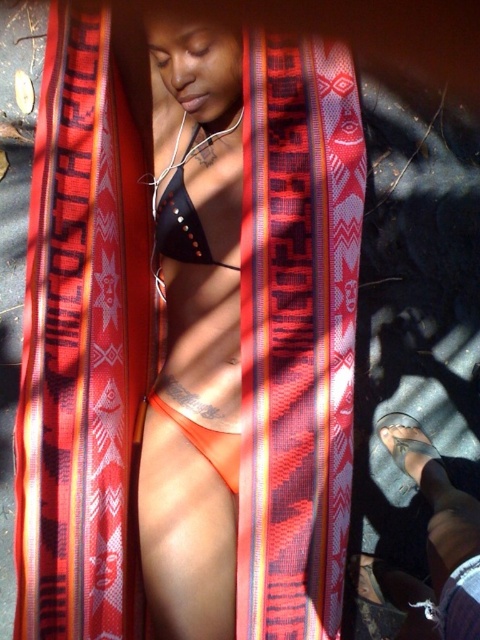
Is orange fabric bikini bottom at center positioned before orange matte bikini at center?

Yes, orange fabric bikini bottom at center is in front of orange matte bikini at center.

The image size is (480, 640). What do you see at coordinates (199, 337) in the screenshot? I see `orange fabric bikini bottom at center` at bounding box center [199, 337].

Image resolution: width=480 pixels, height=640 pixels. I want to click on orange fabric bikini bottom at center, so click(199, 337).

In the scene shown: Who is more forward, (202, 145) or (184, 202)?

Point (184, 202)

Does orange fabric bikini bottom at center have a lesser height compared to black studded bikini top at center?

No.

The width and height of the screenshot is (480, 640). Describe the element at coordinates (199, 337) in the screenshot. I see `orange fabric bikini bottom at center` at that location.

Where is `orange fabric bikini bottom at center`? orange fabric bikini bottom at center is located at coordinates (199, 337).

Is point (184, 163) closer to viewer compared to point (206, 429)?

That is True.

Is black studded bikini top at center shorter than orange matte bikini at center?

In fact, black studded bikini top at center may be taller than orange matte bikini at center.

Is point (180, 173) closer to camera compared to point (179, 417)?

Yes, it is in front of point (179, 417).

The width and height of the screenshot is (480, 640). Identify the location of black studded bikini top at center. (182, 209).